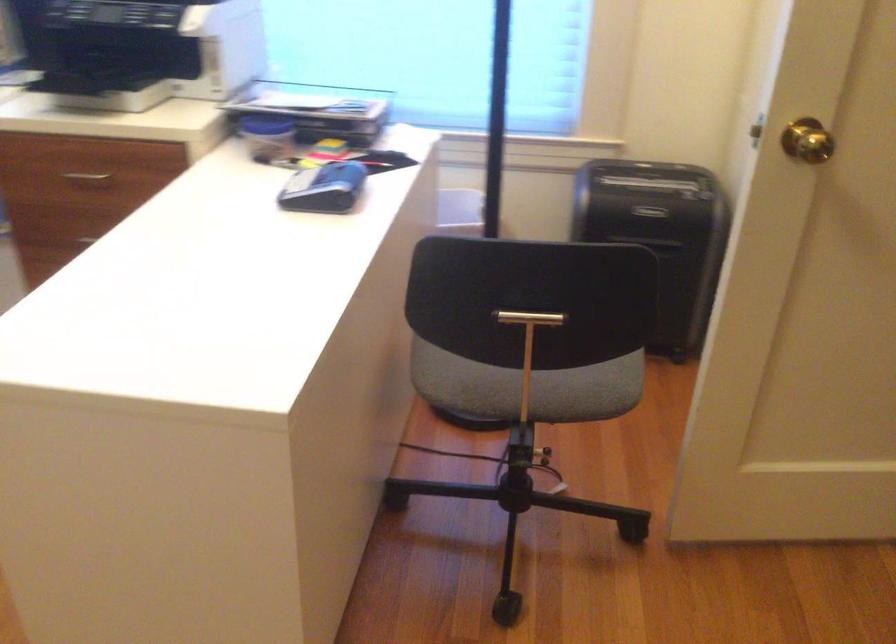
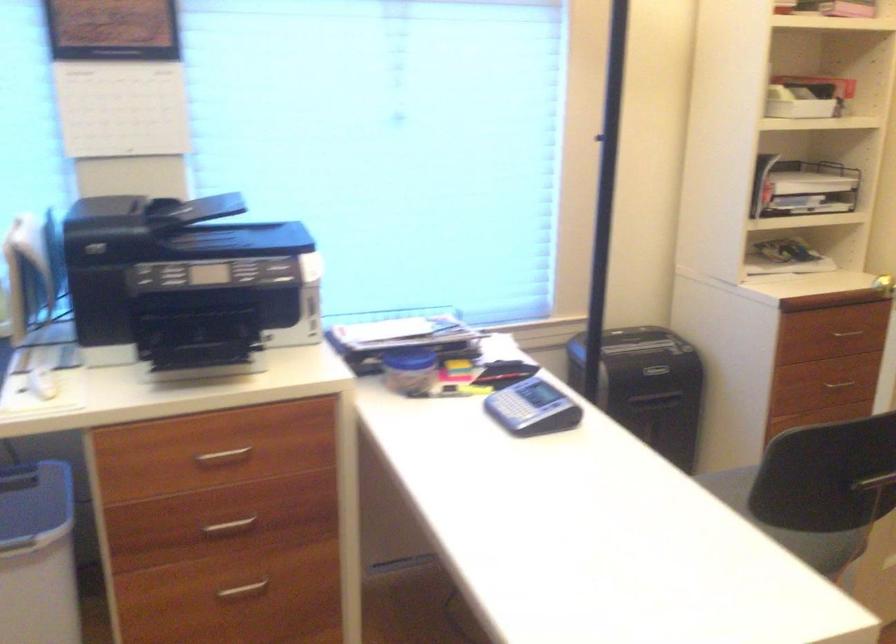
Question: How did the camera likely rotate?

Choices:
 (A) Left
 (B) Right
 (C) Up
 (D) Down

Answer: (B)